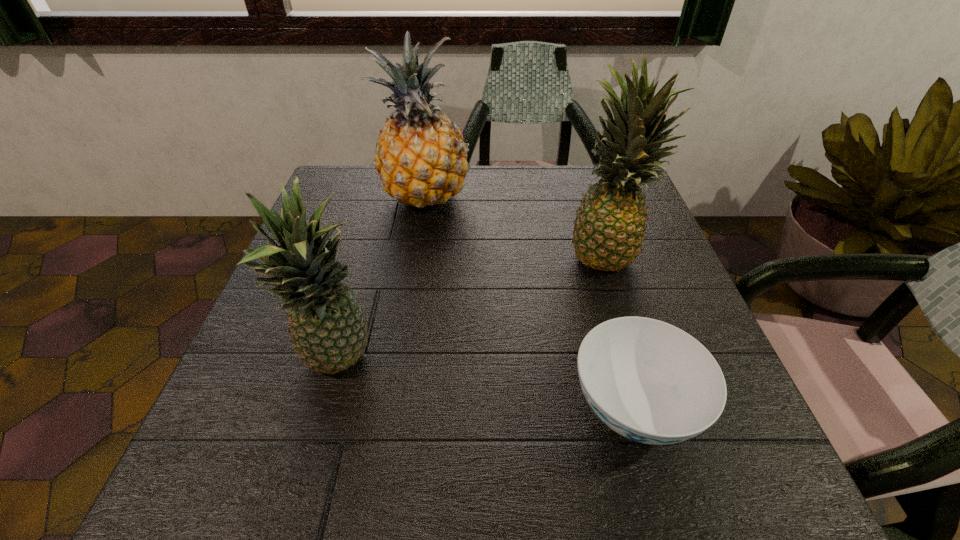
At what (x,y) coordinates should I click in order to perform the action: click on the second nearest pineapple. Please return your answer as a coordinate pair (x, y). Image resolution: width=960 pixels, height=540 pixels. Looking at the image, I should click on (609, 227).

The image size is (960, 540). Find the location of `the rightmost pineapple`. the rightmost pineapple is located at coordinates (609, 227).

Locate an element on the screen. the farthest pineapple is located at coordinates (421, 159).

Locate an element on the screen. The height and width of the screenshot is (540, 960). the nearest pineapple is located at coordinates (329, 331).

Identify the location of the shortest object. (649, 381).

Find the location of a particular element. This screenshot has height=540, width=960. blank space located 0.210m on the left of the third nearest object is located at coordinates (470, 255).

This screenshot has width=960, height=540. Find the location of `free point located on the front of the farthest object`. free point located on the front of the farthest object is located at coordinates (405, 330).

The height and width of the screenshot is (540, 960). Find the location of `vacant space located on the right of the nearest pineapple`. vacant space located on the right of the nearest pineapple is located at coordinates (613, 363).

Identify the location of blank area located 0.280m on the back of the shortest object. (589, 253).

Find the location of a particular element. This screenshot has width=960, height=540. object at the far edge is located at coordinates (421, 159).